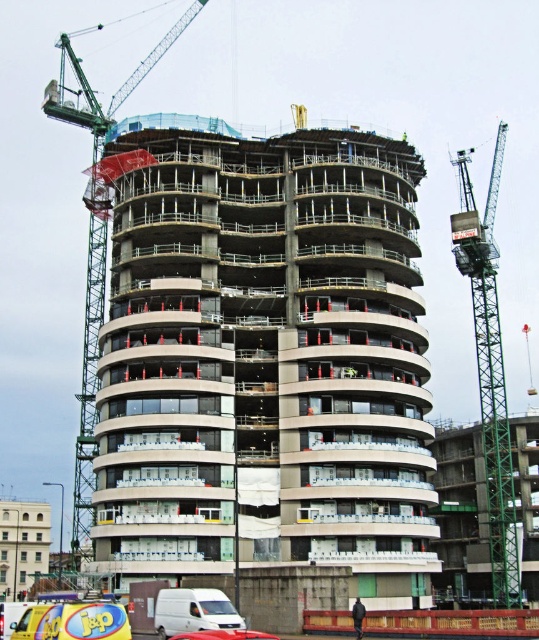
Question: Where is white matte van at lower center located in relation to metallic silver car at center in the image?

Choices:
 (A) right
 (B) left

Answer: (B)

Question: Among these objects, which one is nearest to the camera?

Choices:
 (A) white matte van at lower center
 (B) metallic silver car at center
 (C) dark blue fabric at lower center

Answer: (B)

Question: Among these objects, which one is nearest to the camera?

Choices:
 (A) yellow rubber ambulance at lower left
 (B) dark blue fabric at lower center

Answer: (A)

Question: Observing the image, what is the correct spatial positioning of green metallic crane at left in reference to dark blue fabric at lower center?

Choices:
 (A) above
 (B) below

Answer: (A)

Question: From the image, what is the correct spatial relationship of green metallic crane at left in relation to metallic silver car at center?

Choices:
 (A) below
 (B) above

Answer: (B)

Question: Which point is farther from the camera taking this photo?

Choices:
 (A) (113, 611)
 (B) (507, 412)
 (C) (158, 221)

Answer: (B)